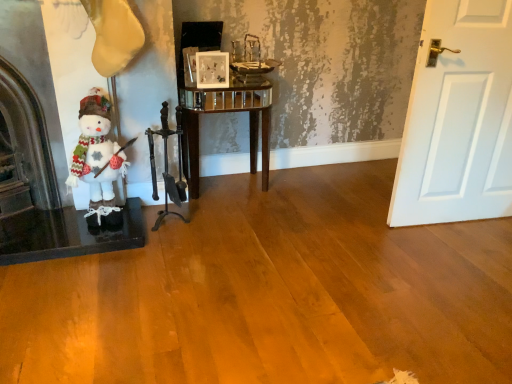
Question: Considering the relative sizes of dark brown polished wood fireplace tools at center and dark brown stone fireplace at left in the image provided, is dark brown polished wood fireplace tools at center wider than dark brown stone fireplace at left?

Choices:
 (A) yes
 (B) no

Answer: (B)

Question: Is dark brown polished wood fireplace tools at center shorter than dark brown stone fireplace at left?

Choices:
 (A) no
 (B) yes

Answer: (B)

Question: Is dark brown polished wood fireplace tools at center next to dark brown stone fireplace at left?

Choices:
 (A) no
 (B) yes

Answer: (A)

Question: Does dark brown polished wood fireplace tools at center turn towards dark brown stone fireplace at left?

Choices:
 (A) yes
 (B) no

Answer: (B)

Question: Does dark brown polished wood fireplace tools at center contain dark brown stone fireplace at left?

Choices:
 (A) no
 (B) yes

Answer: (A)

Question: Visually, is dark brown polished wood fireplace tools at center positioned to the left or to the right of glossy wood side table at center?

Choices:
 (A) right
 (B) left

Answer: (B)

Question: From the image's perspective, is dark brown polished wood fireplace tools at center above or below glossy wood side table at center?

Choices:
 (A) above
 (B) below

Answer: (B)

Question: Considering the positions of point (178, 152) and point (227, 109), is point (178, 152) closer or farther from the camera than point (227, 109)?

Choices:
 (A) closer
 (B) farther

Answer: (A)

Question: From a real-world perspective, is dark brown polished wood fireplace tools at center above or below glossy wood side table at center?

Choices:
 (A) above
 (B) below

Answer: (B)

Question: In terms of size, does glossy wood side table at center appear bigger or smaller than matte glass picture frame at center?

Choices:
 (A) small
 (B) big

Answer: (B)

Question: Is point (240, 99) positioned closer to the camera than point (212, 56)?

Choices:
 (A) farther
 (B) closer

Answer: (A)

Question: From the image's perspective, is glossy wood side table at center located above or below matte glass picture frame at center?

Choices:
 (A) below
 (B) above

Answer: (A)

Question: Is glossy wood side table at center wider or thinner than matte glass picture frame at center?

Choices:
 (A) thin
 (B) wide

Answer: (B)

Question: Looking at the image, does dark brown polished wood fireplace tools at center seem bigger or smaller compared to dark brown stone fireplace at left?

Choices:
 (A) small
 (B) big

Answer: (A)

Question: Is dark brown polished wood fireplace tools at center in front of or behind dark brown stone fireplace at left in the image?

Choices:
 (A) behind
 (B) front

Answer: (A)